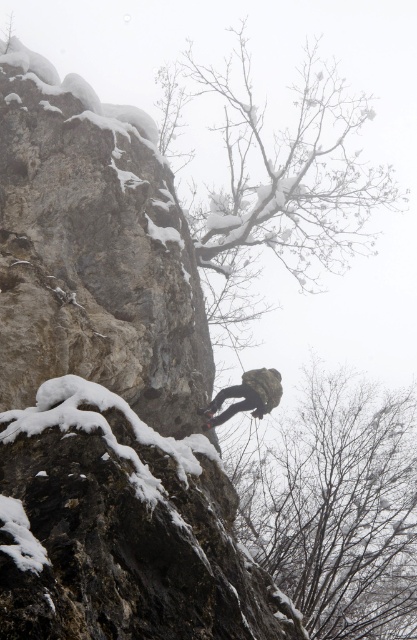
In the winter scene, there is a climber ascending a steep, snow covered rock face. You notice a point marked at coordinates [336,508]. What object or feature is located at this point?

The point at coordinates [336,508] corresponds to the bare branches at center.